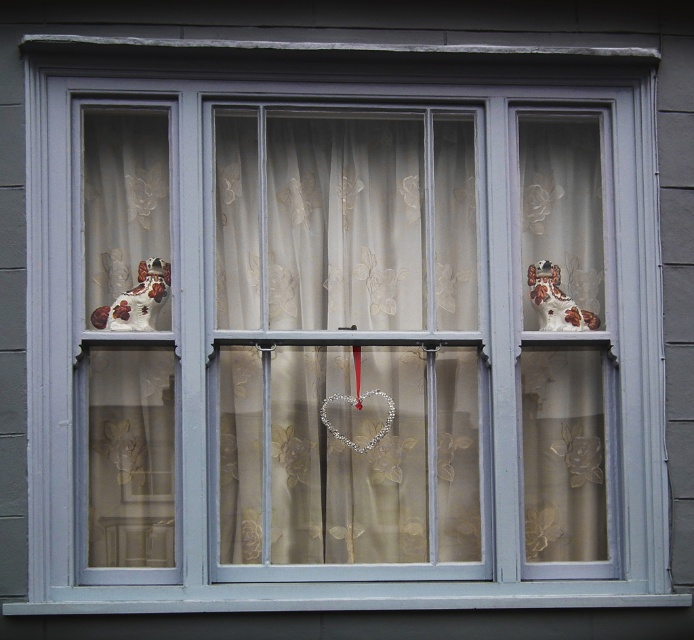
Is smooth concrete window sill at bottom shorter than porcelain dog at upper right?

Yes, smooth concrete window sill at bottom is shorter than porcelain dog at upper right.

Measure the distance between smooth concrete window sill at bottom and porcelain dog at upper right.

A distance of 26.97 inches exists between smooth concrete window sill at bottom and porcelain dog at upper right.

Who is more distant from viewer, [393,584] or [543,275]?

The point [543,275] is behind.

Locate an element on the screen. The width and height of the screenshot is (694, 640). smooth concrete window sill at bottom is located at coordinates (355, 598).

Is sheer floral at center smaller than porcelain dog at upper right?

No, sheer floral at center is not smaller than porcelain dog at upper right.

Does sheer floral at center appear over porcelain dog at upper right?

Actually, sheer floral at center is below porcelain dog at upper right.

Which is in front, point (448, 182) or point (557, 300)?

Point (557, 300) is in front.

What are the coordinates of `sheer floral at center` in the screenshot? It's located at (347, 337).

Image resolution: width=694 pixels, height=640 pixels. What do you see at coordinates (347, 337) in the screenshot?
I see `sheer floral at center` at bounding box center [347, 337].

Who is more forward, (314, 468) or (362, 589)?

Point (362, 589) is more forward.

Is point (269, 292) positioned after point (341, 605)?

Yes, point (269, 292) is behind point (341, 605).

Where is `sheer floral at center`? The image size is (694, 640). sheer floral at center is located at coordinates (347, 337).